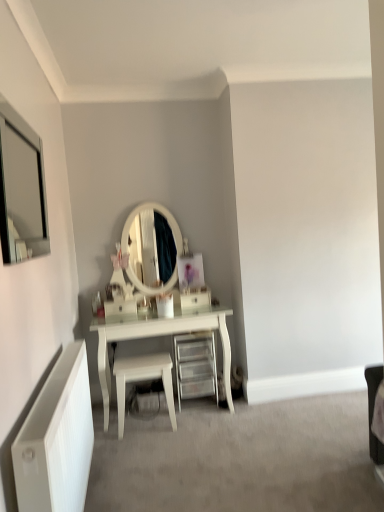
Image resolution: width=384 pixels, height=512 pixels. What are the coordinates of `empty space that is ontop of white glossy drawer at center (from a real-world perspective)` in the screenshot? It's located at (193, 292).